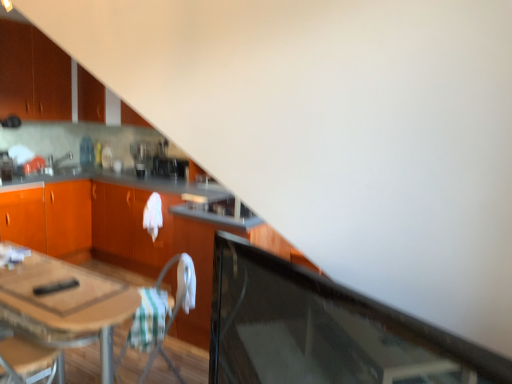
Measure the distance between white fabric folding chair at center and camera.

The depth of white fabric folding chair at center is 7.07 feet.

This screenshot has width=512, height=384. Describe the element at coordinates (149, 320) in the screenshot. I see `green striped fabric at lower center` at that location.

In the scene shown: In order to face green striped fabric at lower center, should I rotate leftwards or rightwards?

You should look left and rotate roughly 14.106 degrees.

Find the location of a particular element. metallic silver toaster at left, acting as the 2th appliance starting from the right is located at coordinates (6, 167).

The image size is (512, 384). I want to click on matte orange cabinet at upper left, marked as the 1th cabinetry in a top-to-bottom arrangement, so click(33, 75).

Image resolution: width=512 pixels, height=384 pixels. Identify the location of wooden table at lower left. (66, 304).

At what (x,y) coordinates should I click in order to perform the action: click on transparent glass door at lower right. Please return your answer as a coordinate pair (x, y). This screenshot has height=384, width=512. Looking at the image, I should click on (324, 331).

The height and width of the screenshot is (384, 512). Describe the element at coordinates (324, 331) in the screenshot. I see `transparent glass door at lower right` at that location.

Image resolution: width=512 pixels, height=384 pixels. I want to click on white fabric folding chair at center, so click(x=174, y=306).

From their relative heights in the image, would you say orange wood cabinetry at center, the 3th cabinetry positioned from the top, is taller or shorter than green striped fabric at lower center?

In the image, orange wood cabinetry at center, the 3th cabinetry positioned from the top, appears to be taller than green striped fabric at lower center.

Considering the relative sizes of orange wood cabinetry at center, the 3th cabinetry positioned from the top, and green striped fabric at lower center in the image provided, is orange wood cabinetry at center, the 3th cabinetry positioned from the top, wider than green striped fabric at lower center?

Yes.

Consider the image. In the image, is orange wood cabinetry at center, the 3th cabinetry positioned from the top, on the left side or the right side of green striped fabric at lower center?

orange wood cabinetry at center, the 3th cabinetry positioned from the top, is to the left of green striped fabric at lower center.

Is matte orange cabinet at upper left, marked as the 1th cabinetry in a top-to-bottom arrangement, located within transparent glass door at lower right?

No.

Is transparent glass door at lower right oriented away from matte orange cabinet at upper left, the 3th cabinetry from the bottom?

No, matte orange cabinet at upper left, the 3th cabinetry from the bottom, is not at the back of transparent glass door at lower right.

Considering the sizes of objects transparent glass door at lower right and matte orange cabinet at upper left, marked as the 1th cabinetry in a top-to-bottom arrangement, in the image provided, who is smaller, transparent glass door at lower right or matte orange cabinet at upper left, marked as the 1th cabinetry in a top-to-bottom arrangement,?

transparent glass door at lower right is smaller.

The width and height of the screenshot is (512, 384). What are the coordinates of `blanket to the right of metallic silver toaster at left, the second appliance in the back-to-front sequence` in the screenshot? It's located at (149, 320).

Can you confirm if metallic silver toaster at left, which is counted as the 1th appliance, starting from the left, is bigger than green striped fabric at lower center?

Incorrect, metallic silver toaster at left, which is counted as the 1th appliance, starting from the left, is not larger than green striped fabric at lower center.

Which is nearer, (8, 174) or (127, 344)?

Point (8, 174).

In the scene shown: Is metallic silver toaster at left, acting as the 1th appliance starting from the front, far away from green striped fabric at lower center?

Indeed, metallic silver toaster at left, acting as the 1th appliance starting from the front, is not near green striped fabric at lower center.

Can we say green striped fabric at lower center lies outside orange wood cabinetry at center, which appears as the 1th cabinetry when ordered from the bottom?

That's correct, green striped fabric at lower center is outside of orange wood cabinetry at center, which appears as the 1th cabinetry when ordered from the bottom.

Is green striped fabric at lower center aimed at orange wood cabinetry at center, the 3th cabinetry positioned from the top?

No.

You are a GUI agent. You are given a task and a screenshot of the screen. Output one action in this format:
    pyautogui.click(x=<x>, y=<y>)
    Task: Click on the 1st cabinetry to the left of the green striped fabric at lower center, starting your count from the anchor
    Image resolution: width=512 pixels, height=384 pixels.
    Given the screenshot: What is the action you would take?
    coord(125,234)

From the image's perspective, would you say matte orange cabinet at upper left, marked as the 1th cabinetry in a top-to-bottom arrangement, is positioned over metallic silver toaster at left, the second appliance in the back-to-front sequence?

Yes, from the image's perspective, matte orange cabinet at upper left, marked as the 1th cabinetry in a top-to-bottom arrangement, is over metallic silver toaster at left, the second appliance in the back-to-front sequence.

Is matte orange cabinet at upper left, the 3th cabinetry from the bottom, next to metallic silver toaster at left, acting as the 1th appliance starting from the front?

No, matte orange cabinet at upper left, the 3th cabinetry from the bottom, is not in contact with metallic silver toaster at left, acting as the 1th appliance starting from the front.

From a real-world perspective, is matte orange cabinet at upper left, the 3th cabinetry from the bottom, physically located above or below metallic silver toaster at left, which is counted as the 1th appliance, starting from the left?

From a real-world perspective, matte orange cabinet at upper left, the 3th cabinetry from the bottom, is physically above metallic silver toaster at left, which is counted as the 1th appliance, starting from the left.

What's the angular difference between matte orange cabinet at upper left, marked as the 1th cabinetry in a top-to-bottom arrangement, and metallic silver toaster at left, the second appliance in the back-to-front sequence,'s facing directions?

The angular difference between matte orange cabinet at upper left, marked as the 1th cabinetry in a top-to-bottom arrangement, and metallic silver toaster at left, the second appliance in the back-to-front sequence, is 0.000105 degrees.

From a real-world perspective, which is physically above, transparent glass door at lower right or orange wood cabinetry at center, which appears as the 1th cabinetry when ordered from the bottom?

From a 3D spatial view, transparent glass door at lower right is above.

Consider the image. Is transparent glass door at lower right turned away from orange wood cabinetry at center, which appears as the 1th cabinetry when ordered from the bottom?

No.

The width and height of the screenshot is (512, 384). In order to click on the 1st cabinetry behind when counting from the transparent glass door at lower right in this screenshot , I will do (125, 234).

From the image's perspective, is transparent glass door at lower right above or below orange wood cabinetry at center, which appears as the 1th cabinetry when ordered from the bottom?

From the image's perspective, transparent glass door at lower right appears below orange wood cabinetry at center, which appears as the 1th cabinetry when ordered from the bottom.

Does matte orange cabinet at upper left, the 3th cabinetry from the bottom, have a smaller size compared to white fabric folding chair at center?

No.

The height and width of the screenshot is (384, 512). What are the coordinates of `folding chair that is in front of the matte orange cabinet at upper left, the 3th cabinetry from the bottom` in the screenshot? It's located at (174, 306).

Between matte orange cabinet at upper left, marked as the 1th cabinetry in a top-to-bottom arrangement, and white fabric folding chair at center, which one is positioned behind?

matte orange cabinet at upper left, marked as the 1th cabinetry in a top-to-bottom arrangement, is more distant.

Which of these two, matte orange cabinet at upper left, marked as the 1th cabinetry in a top-to-bottom arrangement, or white fabric folding chair at center, stands taller?

matte orange cabinet at upper left, marked as the 1th cabinetry in a top-to-bottom arrangement, is taller.

Where is `blanket below the orange wood cabinetry at center, which appears as the 1th cabinetry when ordered from the bottom (from a real-world perspective)`? This screenshot has height=384, width=512. blanket below the orange wood cabinetry at center, which appears as the 1th cabinetry when ordered from the bottom (from a real-world perspective) is located at coordinates (149, 320).

Locate an element on the screen. This screenshot has height=384, width=512. glass door on the right side of matte orange cabinet at upper left, marked as the 1th cabinetry in a top-to-bottom arrangement is located at coordinates coord(324,331).

Considering their positions, is orange wood cabinetry at center, which appears as the 1th cabinetry when ordered from the bottom, positioned closer to wooden table at lower left than matte silver sink at upper left?

orange wood cabinetry at center, which appears as the 1th cabinetry when ordered from the bottom, is positioned closer to the anchor wooden table at lower left.

Considering their positions, is matte silver sink at upper left positioned closer to transparent glass door at lower right than matte orange cabinet at upper left, the 3th cabinetry from the bottom?

The object closer to transparent glass door at lower right is matte orange cabinet at upper left, the 3th cabinetry from the bottom.

Which object lies further to the anchor point matte silver sink at upper left, metallic silver toaster at left, which is counted as the 1th appliance, starting from the left, or satin black coffee maker at center, acting as the 1th appliance starting from the back?

The object further to matte silver sink at upper left is satin black coffee maker at center, acting as the 1th appliance starting from the back.

In the scene shown: Looking at the image, which one is located further to white fabric folding chair at center, matte orange cabinet at upper left, marked as the 1th cabinetry in a top-to-bottom arrangement, or wooden table at lower left?

matte orange cabinet at upper left, marked as the 1th cabinetry in a top-to-bottom arrangement, lies further to white fabric folding chair at center than the other object.

Based on the photo, considering their positions, is matte orange cabinet at upper left, marked as the 1th cabinetry in a top-to-bottom arrangement, positioned closer to green striped fabric at lower center than metallic silver toaster at left, the second appliance in the back-to-front sequence?

The object closer to green striped fabric at lower center is metallic silver toaster at left, the second appliance in the back-to-front sequence.

Considering their positions, is transparent glass door at lower right positioned closer to metallic silver toaster at left, acting as the 1th appliance starting from the front, than green striped fabric at lower center?

Based on the image, green striped fabric at lower center appears to be nearer to metallic silver toaster at left, acting as the 1th appliance starting from the front.

When comparing their distances from matte silver sink at upper left, does green striped fabric at lower center or white fabric folding chair at center seem further?

green striped fabric at lower center is further to matte silver sink at upper left.

Estimate the real-world distances between objects in this image. Which object is further from wooden table at lower left, white fabric folding chair at center or satin black coffee maker at center, which is the second appliance from left to right?

satin black coffee maker at center, which is the second appliance from left to right.

This screenshot has width=512, height=384. I want to click on blanket between wooden table at lower left and metallic silver toaster at left, which is counted as the 1th appliance, starting from the left, along the z-axis, so click(149, 320).

You are a GUI agent. You are given a task and a screenshot of the screen. Output one action in this format:
    pyautogui.click(x=<x>, y=<y>)
    Task: Click on the folding chair located between wooden table at lower left and matte silver sink at upper left in the depth direction
    
    Given the screenshot: What is the action you would take?
    pyautogui.click(x=174, y=306)

Where is `appliance between white fabric folding chair at center and satin black coffee maker at center, acting as the 1th appliance starting from the back, along the z-axis`? This screenshot has height=384, width=512. appliance between white fabric folding chair at center and satin black coffee maker at center, acting as the 1th appliance starting from the back, along the z-axis is located at coordinates (6, 167).

At what (x,y) coordinates should I click in order to perform the action: click on appliance located between orange wood cabinetry at center, which appears as the 1th cabinetry when ordered from the bottom, and satin black coffee maker at center, which appears as the first appliance when viewed from the right, in the depth direction. Please return your answer as a coordinate pair (x, y). Looking at the image, I should click on (6, 167).